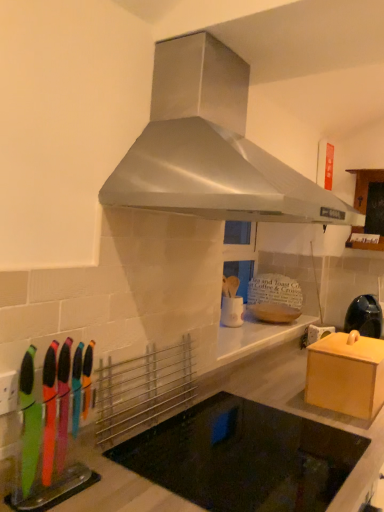
The height and width of the screenshot is (512, 384). Find the location of `free space above stainless steel range hood at upper center (from a real-world perspective)`. free space above stainless steel range hood at upper center (from a real-world perspective) is located at coordinates (268, 31).